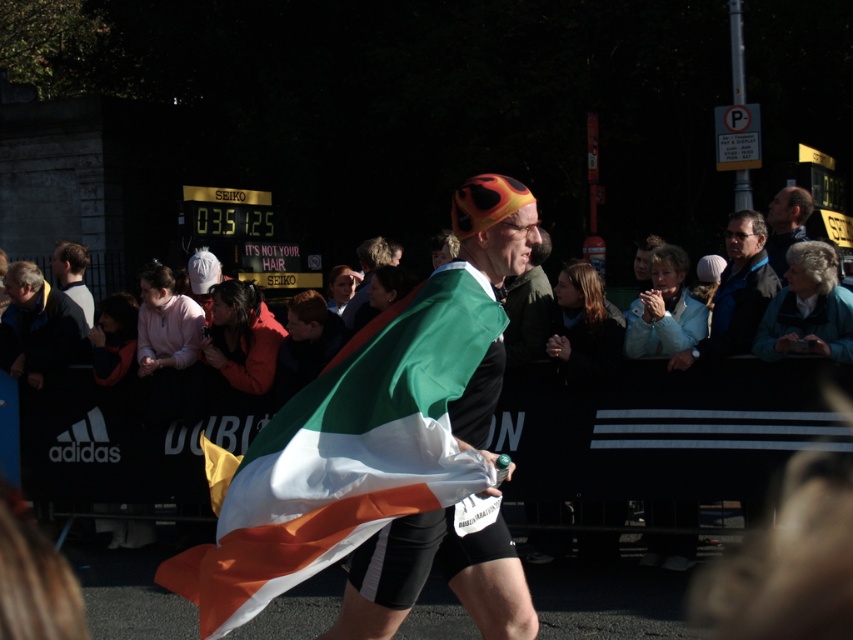
You are a photographer positioned at the starting line of the marathon. You want to capture a closeup shot of the irish flag at center without moving your camera. Can you estimate if the flag is within the optimal focus range of your camera, which is set to focus on objects between 10 and 15 feet away?

The irish flag at center is 12.76 feet away from camera, which falls within the optimal focus range of 10 to 15 feet. Therefore, the flag will be in focus without needing to adjust the camera settings.

You are a photographer at the marathon event. You want to capture a photo of both the irish flag at center and the green fabric flag at center without any obstructions. Based on their sizes, which flag should you focus on first to ensure it fits in the frame?

The irish flag at center is not as tall as the green fabric flag at center, so you should focus on capturing the green fabric flag at center first since it is taller and might require more space in the frame to avoid obstructions.